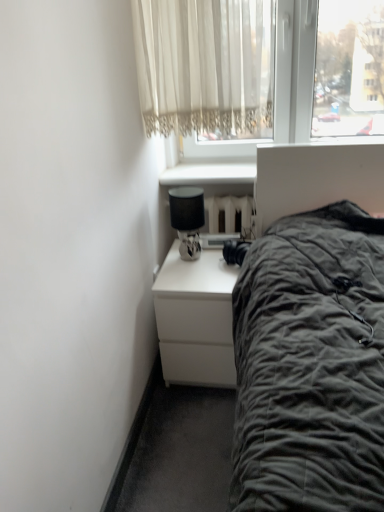
Find the location of a particular element. The height and width of the screenshot is (512, 384). vacant region in front of white matte nightstand at lower center is located at coordinates (186, 428).